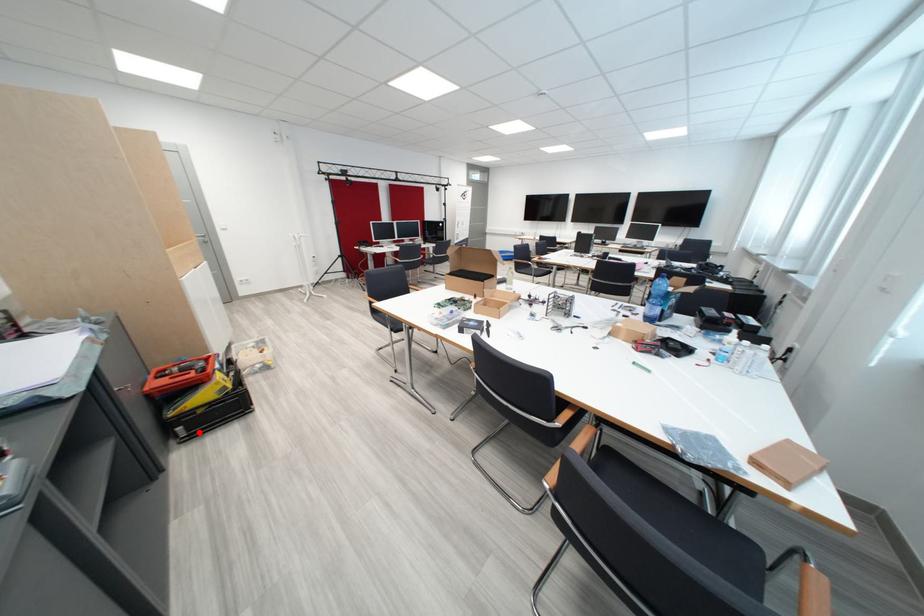
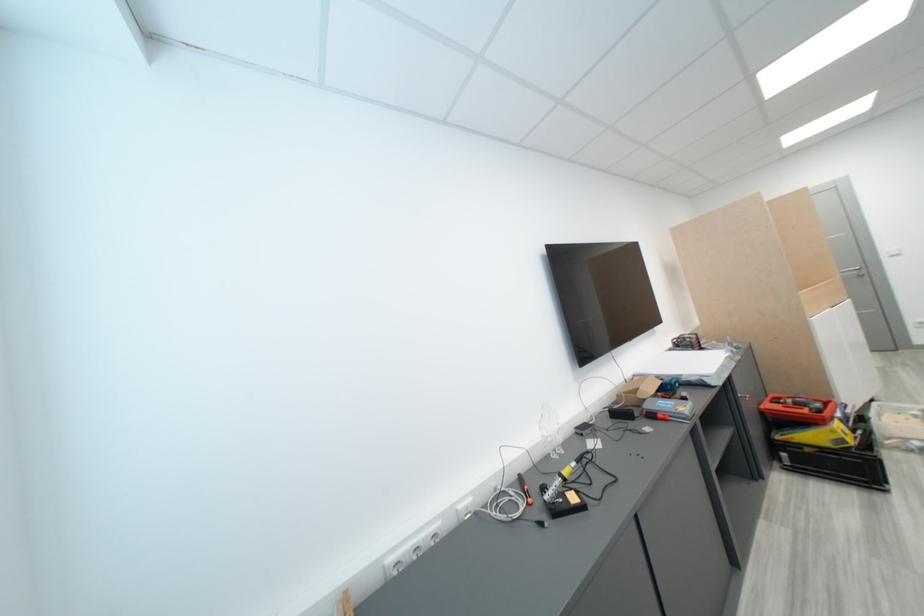
Question: A red point is marked in image1. In image2, is the corresponding 3D point closer to the camera or farther? Reply with the corresponding letter.

Choices:
 (A) The corresponding 3D point is closer.
 (B) The corresponding 3D point is farther.

Answer: (A)